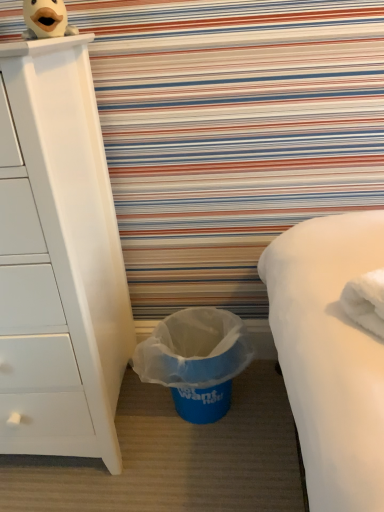
Question: From their relative heights in the image, would you say white matte chest of drawers at left is taller or shorter than blue plastic trash can at lower center?

Choices:
 (A) tall
 (B) short

Answer: (A)

Question: Considering the positions of white matte chest of drawers at left and blue plastic trash can at lower center in the image, is white matte chest of drawers at left wider or thinner than blue plastic trash can at lower center?

Choices:
 (A) thin
 (B) wide

Answer: (B)

Question: Considering the real-world distances, which object is closest to the plush duck at upper left?

Choices:
 (A) blue plastic trash can at lower center
 (B) white matte chest of drawers at left

Answer: (B)

Question: Which object is positioned closest to the white matte chest of drawers at left?

Choices:
 (A) plush duck at upper left
 (B) blue plastic trash can at lower center

Answer: (B)